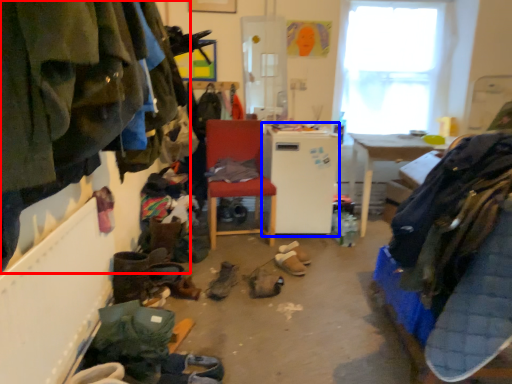
Question: Which point is further to the camera, clothing (highlighted by a red box) or appliance (highlighted by a blue box)?

Choices:
 (A) clothing
 (B) appliance

Answer: (B)